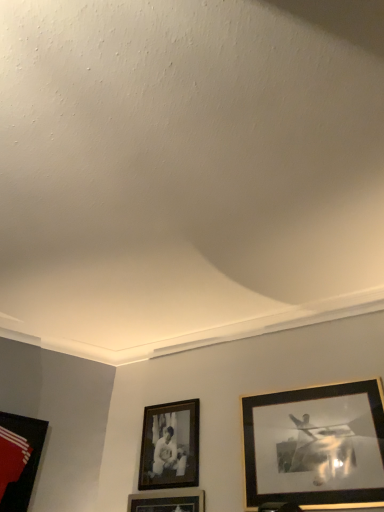
You are a GUI agent. You are given a task and a screenshot of the screen. Output one action in this format:
    pyautogui.click(x=<x>, y=<y>)
    Task: Click on the gold-framed picture at right, which is the 3th picture frame in left-to-right order
    The image size is (384, 512).
    Given the screenshot: What is the action you would take?
    pyautogui.click(x=315, y=446)

In order to face gold-framed picture at right, which is the 3th picture frame in left-to-right order, should I rotate leftwards or rightwards?

Rotate right and turn 15.486 degrees.

Image resolution: width=384 pixels, height=512 pixels. Describe the element at coordinates (19, 459) in the screenshot. I see `matte black picture frame at lower left, the 3th picture frame from the right` at that location.

Where is `gold-framed picture at right, which is the 3th picture frame in left-to-right order`? gold-framed picture at right, which is the 3th picture frame in left-to-right order is located at coordinates [315, 446].

From the picture: From a real-world perspective, is gold-framed picture at right, the first picture frame when ordered from right to left, beneath black matte picture frame at center, the second picture frame in the right-to-left sequence?

Yes.

Is black matte picture frame at center, the 2th picture frame when ordered from left to right, at the back of gold-framed picture at right, the first picture frame when ordered from right to left?

No.

Could you measure the distance between gold-framed picture at right, which is the 3th picture frame in left-to-right order, and black matte picture frame at center, the 2th picture frame when ordered from left to right?

A distance of 26.58 inches exists between gold-framed picture at right, which is the 3th picture frame in left-to-right order, and black matte picture frame at center, the 2th picture frame when ordered from left to right.

From the picture: Which object is thinner, black matte picture frame at center, the 2th picture frame when ordered from left to right, or gold-framed picture at right, the first picture frame when ordered from right to left?

With smaller width is gold-framed picture at right, the first picture frame when ordered from right to left.

Does black matte picture frame at center, the second picture frame in the right-to-left sequence, have a lesser height compared to gold-framed picture at right, the first picture frame when ordered from right to left?

Indeed, black matte picture frame at center, the second picture frame in the right-to-left sequence, has a lesser height compared to gold-framed picture at right, the first picture frame when ordered from right to left.

Can gold-framed picture at right, the first picture frame when ordered from right to left, be found inside black matte picture frame at center, the 2th picture frame when ordered from left to right?

No, black matte picture frame at center, the 2th picture frame when ordered from left to right, does not contain gold-framed picture at right, the first picture frame when ordered from right to left.

From a real-world perspective, does black matte picture frame at center, the 2th picture frame when ordered from left to right, stand above gold-framed picture at right, which is the 3th picture frame in left-to-right order?

Yes.

What's the angular difference between gold-framed picture at right, which is the 3th picture frame in left-to-right order, and matte black picture frame at lower left, the 3th picture frame from the right,'s facing directions?

The angle between the facing direction of gold-framed picture at right, which is the 3th picture frame in left-to-right order, and the facing direction of matte black picture frame at lower left, the 3th picture frame from the right, is 57.7 degrees.

I want to click on picture frame that is the 1st object located behind the gold-framed picture at right, which is the 3th picture frame in left-to-right order, so tap(19, 459).

Is gold-framed picture at right, which is the 3th picture frame in left-to-right order, at the right side of matte black picture frame at lower left, positioned as the 1th picture frame in left-to-right order?

Yes.

From the picture: Is gold-framed picture at right, which is the 3th picture frame in left-to-right order, oriented towards matte black picture frame at lower left, the 3th picture frame from the right?

No, gold-framed picture at right, which is the 3th picture frame in left-to-right order, is not oriented towards matte black picture frame at lower left, the 3th picture frame from the right.

Can you confirm if matte black picture frame at lower left, positioned as the 1th picture frame in left-to-right order, is bigger than black matte picture frame at center, the 2th picture frame when ordered from left to right?

Yes, matte black picture frame at lower left, positioned as the 1th picture frame in left-to-right order, is bigger than black matte picture frame at center, the 2th picture frame when ordered from left to right.

Which is nearer, (22, 454) or (145, 440)?

Clearly, point (22, 454) is closer to the camera than point (145, 440).

In the scene shown: From the image's perspective, is matte black picture frame at lower left, positioned as the 1th picture frame in left-to-right order, over black matte picture frame at center, the 2th picture frame when ordered from left to right?

No, from the image's perspective, matte black picture frame at lower left, positioned as the 1th picture frame in left-to-right order, is not above black matte picture frame at center, the 2th picture frame when ordered from left to right.

Considering the sizes of objects black matte picture frame at center, the 2th picture frame when ordered from left to right, and matte black picture frame at lower left, the 3th picture frame from the right, in the image provided, who is bigger, black matte picture frame at center, the 2th picture frame when ordered from left to right, or matte black picture frame at lower left, the 3th picture frame from the right,?

matte black picture frame at lower left, the 3th picture frame from the right.

Between black matte picture frame at center, the second picture frame in the right-to-left sequence, and matte black picture frame at lower left, the 3th picture frame from the right, which one has less height?

black matte picture frame at center, the second picture frame in the right-to-left sequence.

Is black matte picture frame at center, the 2th picture frame when ordered from left to right, next to matte black picture frame at lower left, the 3th picture frame from the right, and touching it?

No, black matte picture frame at center, the 2th picture frame when ordered from left to right, is not making contact with matte black picture frame at lower left, the 3th picture frame from the right.

Is black matte picture frame at center, the second picture frame in the right-to-left sequence, facing towards matte black picture frame at lower left, the 3th picture frame from the right?

No.

From the image's perspective, is matte black picture frame at lower left, the 3th picture frame from the right, over gold-framed picture at right, the first picture frame when ordered from right to left?

Actually, matte black picture frame at lower left, the 3th picture frame from the right, appears below gold-framed picture at right, the first picture frame when ordered from right to left, in the image.

Is matte black picture frame at lower left, positioned as the 1th picture frame in left-to-right order, further to camera compared to gold-framed picture at right, which is the 3th picture frame in left-to-right order?

Yes, it is.

Which object is thinner, matte black picture frame at lower left, the 3th picture frame from the right, or gold-framed picture at right, the first picture frame when ordered from right to left?

gold-framed picture at right, the first picture frame when ordered from right to left.

Considering the relative sizes of matte black picture frame at lower left, positioned as the 1th picture frame in left-to-right order, and gold-framed picture at right, the first picture frame when ordered from right to left, in the image provided, is matte black picture frame at lower left, positioned as the 1th picture frame in left-to-right order, taller than gold-framed picture at right, the first picture frame when ordered from right to left,?

No, matte black picture frame at lower left, positioned as the 1th picture frame in left-to-right order, is not taller than gold-framed picture at right, the first picture frame when ordered from right to left.

Find the location of a particular element. picture frame on the right side of black matte picture frame at center, the 2th picture frame when ordered from left to right is located at coordinates (315, 446).

From the image's perspective, which picture frame is the 1st one below the gold-framed picture at right, which is the 3th picture frame in left-to-right order? Please provide its 2D coordinates.

[(170, 446)]

Based on their spatial positions, is gold-framed picture at right, the first picture frame when ordered from right to left, or black matte picture frame at center, the 2th picture frame when ordered from left to right, further from matte black picture frame at lower left, the 3th picture frame from the right?

gold-framed picture at right, the first picture frame when ordered from right to left.

Looking at the image, which one is located further to gold-framed picture at right, the first picture frame when ordered from right to left, black matte picture frame at center, the 2th picture frame when ordered from left to right, or matte black picture frame at lower left, positioned as the 1th picture frame in left-to-right order?

matte black picture frame at lower left, positioned as the 1th picture frame in left-to-right order, is positioned further to the anchor gold-framed picture at right, the first picture frame when ordered from right to left.

From the image, which object appears to be nearer to black matte picture frame at center, the second picture frame in the right-to-left sequence, gold-framed picture at right, which is the 3th picture frame in left-to-right order, or matte black picture frame at lower left, the 3th picture frame from the right?

The object closer to black matte picture frame at center, the second picture frame in the right-to-left sequence, is gold-framed picture at right, which is the 3th picture frame in left-to-right order.

From the image, which object appears to be nearer to black matte picture frame at center, the 2th picture frame when ordered from left to right, matte black picture frame at lower left, positioned as the 1th picture frame in left-to-right order, or gold-framed picture at right, the first picture frame when ordered from right to left?

gold-framed picture at right, the first picture frame when ordered from right to left.

Considering their positions, is matte black picture frame at lower left, positioned as the 1th picture frame in left-to-right order, positioned closer to gold-framed picture at right, which is the 3th picture frame in left-to-right order, than black matte picture frame at center, the 2th picture frame when ordered from left to right?

black matte picture frame at center, the 2th picture frame when ordered from left to right, is closer to gold-framed picture at right, which is the 3th picture frame in left-to-right order.

When comparing their distances from matte black picture frame at lower left, the 3th picture frame from the right, does black matte picture frame at center, the 2th picture frame when ordered from left to right, or gold-framed picture at right, the first picture frame when ordered from right to left, seem further?

Among the two, gold-framed picture at right, the first picture frame when ordered from right to left, is located further to matte black picture frame at lower left, the 3th picture frame from the right.

Image resolution: width=384 pixels, height=512 pixels. I want to click on picture frame located between matte black picture frame at lower left, the 3th picture frame from the right, and gold-framed picture at right, the first picture frame when ordered from right to left, in the left-right direction, so click(x=170, y=446).